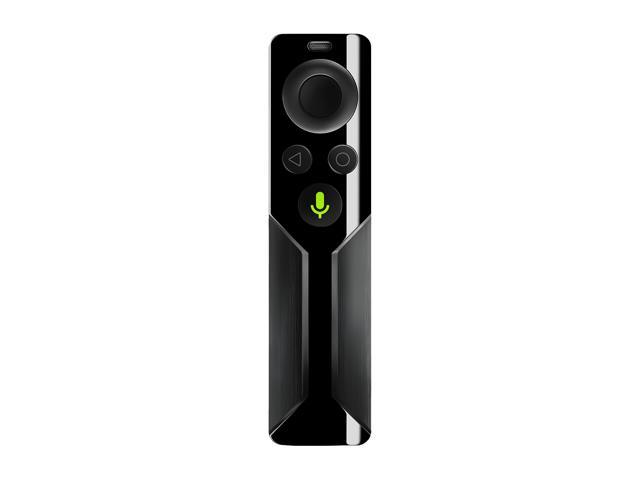
The width and height of the screenshot is (640, 480). I want to click on black remote control, so click(289, 188).